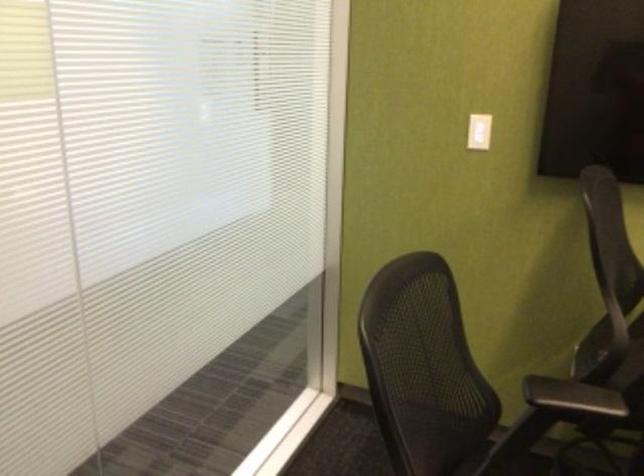
This screenshot has height=476, width=644. Identify the location of chair sitting surface. (422, 368).